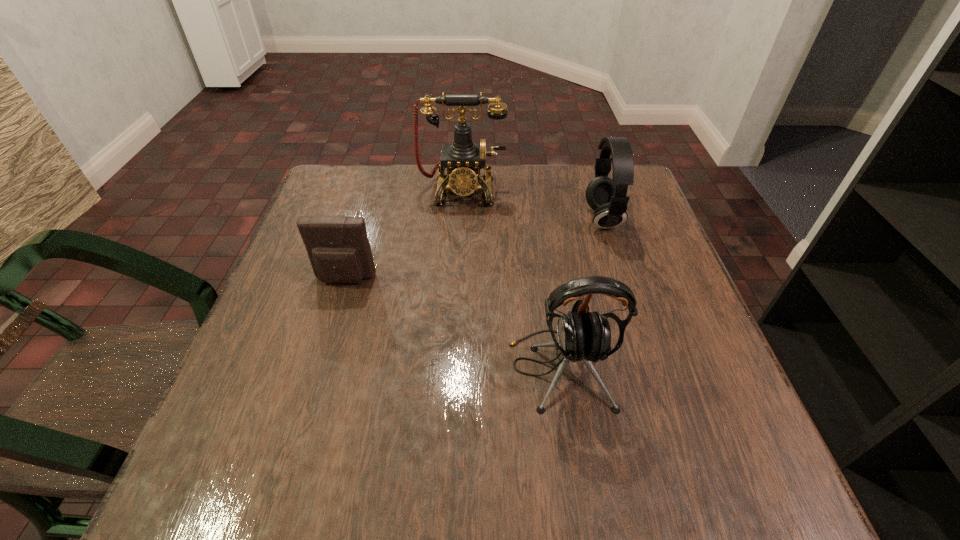
Locate an element on the screen. free space located on the ear cups of the right earphone is located at coordinates (438, 219).

You are a GUI agent. You are given a task and a screenshot of the screen. Output one action in this format:
    pyautogui.click(x=<x>, y=<y>)
    Task: Click on the blank space located 0.160m on the ear cups of the right earphone
    
    Given the screenshot: What is the action you would take?
    pyautogui.click(x=520, y=219)

Identify the location of vacant space located 0.220m with an open flap on the pouch. This screenshot has width=960, height=540. (314, 382).

Where is `telephone that is at the far edge`? telephone that is at the far edge is located at coordinates (463, 159).

The image size is (960, 540). I want to click on earphone at the far edge, so click(606, 196).

Where is `object located at the left edge`? object located at the left edge is located at coordinates (338, 247).

The height and width of the screenshot is (540, 960). In order to click on object at the right edge in this screenshot , I will do `click(606, 196)`.

The width and height of the screenshot is (960, 540). What are the coordinates of `object that is at the far right corner` in the screenshot? It's located at (606, 196).

I want to click on free region at the far edge of the desktop, so click(509, 167).

In order to click on vacant area at the near edge in this screenshot , I will do `click(622, 496)`.